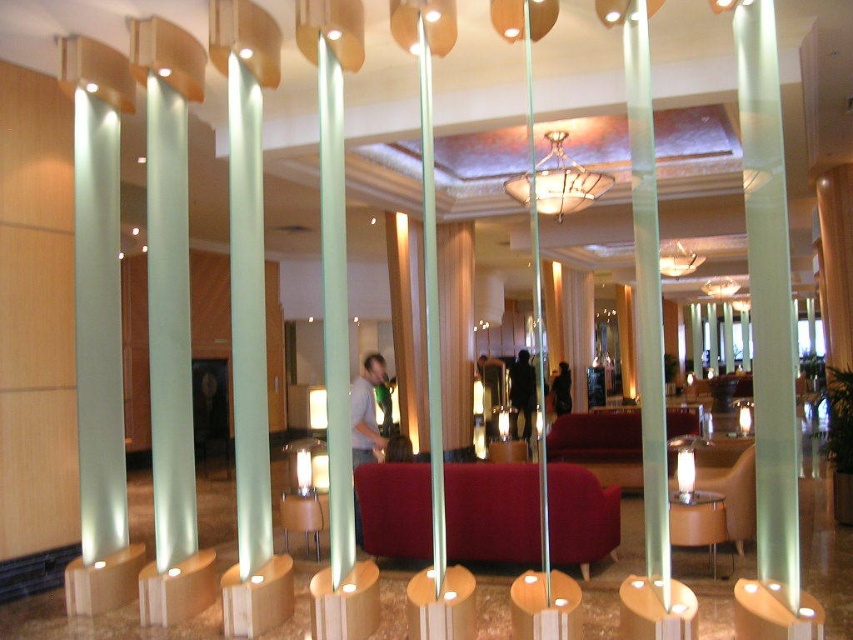
Does frosted glass pillar at center come behind clear glass pole at center?

No, it is in front of clear glass pole at center.

Find the location of `frosted glass pillar at center`. frosted glass pillar at center is located at coordinates (769, 307).

Which is above, clear glass pole at center or matte glass chandelier at center?

Positioned higher is matte glass chandelier at center.

Based on the photo, between clear glass pole at center and matte glass chandelier at center, which one has less height?

With less height is matte glass chandelier at center.

Who is more distant from viewer, [428,349] or [567,179]?

The point [567,179] is more distant.

Where is `clear glass pole at center`? clear glass pole at center is located at coordinates (431, 301).

Can you confirm if transparent glass pillar at center is taller than matte glass chandelier at upper center?

Yes.

Is transparent glass pillar at center bigger than matte glass chandelier at upper center?

Yes, transparent glass pillar at center is bigger than matte glass chandelier at upper center.

Between point (639, 172) and point (668, 259), which one is positioned behind?

The point (668, 259) is more distant.

This screenshot has height=640, width=853. In order to click on transparent glass pillar at center in this screenshot , I will do `click(646, 304)`.